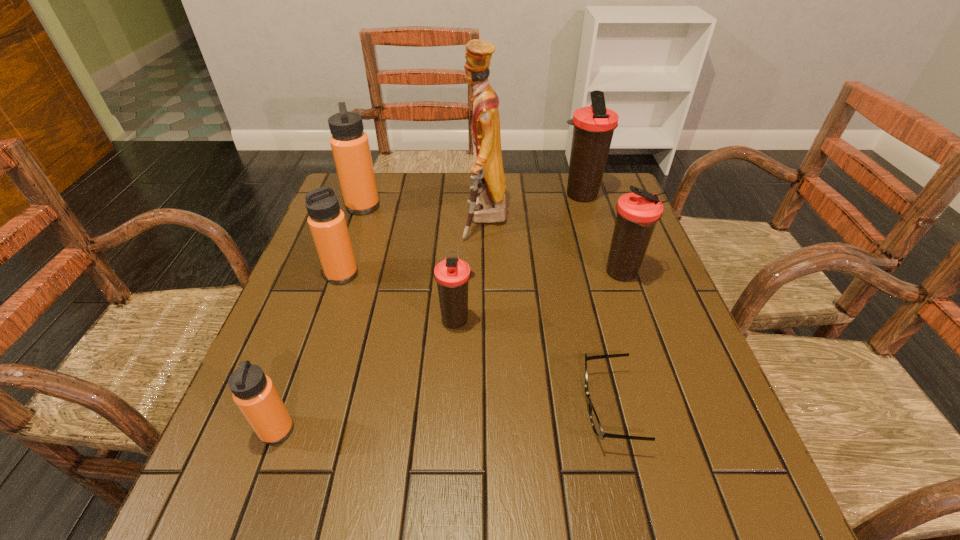
Image resolution: width=960 pixels, height=540 pixels. What are the coordinates of `the shortest object` in the screenshot? It's located at (594, 419).

What are the coordinates of `black spectacles` in the screenshot? It's located at (594, 419).

This screenshot has width=960, height=540. I want to click on blank space located on the front-facing side of the red nutcracker, so click(x=385, y=220).

Locate an element on the screen. The image size is (960, 540). free spot located on the front-facing side of the red nutcracker is located at coordinates (393, 220).

You are a GUI agent. You are given a task and a screenshot of the screen. Output one action in this format:
    pyautogui.click(x=<x>, y=<y>)
    Task: Click on the vacant region located on the front-facing side of the red nutcracker
    
    Given the screenshot: What is the action you would take?
    pyautogui.click(x=374, y=220)

Find the location of a particular element. vacant space situated on the left of the biggest brown thermos bottle is located at coordinates (540, 195).

Where is `vacant space located 0.330m on the right of the farthest orange thermos bottle`? This screenshot has width=960, height=540. vacant space located 0.330m on the right of the farthest orange thermos bottle is located at coordinates (492, 206).

This screenshot has width=960, height=540. In order to click on blank space located 0.280m on the front of the second nearest brown thermos bottle in this screenshot , I will do `click(664, 392)`.

I want to click on free space located on the right of the second nearest orange thermos bottle, so click(440, 274).

This screenshot has height=540, width=960. Identify the location of blank area located 0.140m on the back of the second nearest thermos bottle. (460, 266).